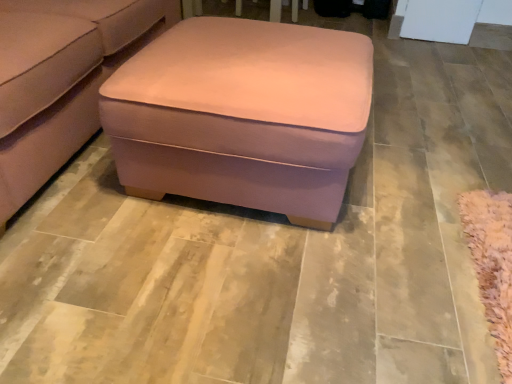
Question: From the image's perspective, is suede-like pink ottoman at center over pink fabric ottoman at center?

Choices:
 (A) yes
 (B) no

Answer: (A)

Question: Is the surface of suede-like pink ottoman at center in direct contact with pink fabric ottoman at center?

Choices:
 (A) no
 (B) yes

Answer: (A)

Question: From a real-world perspective, is suede-like pink ottoman at center located higher than pink fabric ottoman at center?

Choices:
 (A) yes
 (B) no

Answer: (A)

Question: Could you tell me if suede-like pink ottoman at center is facing pink fabric ottoman at center?

Choices:
 (A) no
 (B) yes

Answer: (B)

Question: Is suede-like pink ottoman at center at the right side of pink fabric ottoman at center?

Choices:
 (A) no
 (B) yes

Answer: (A)

Question: Considering the relative sizes of suede-like pink ottoman at center and pink fabric ottoman at center in the image provided, is suede-like pink ottoman at center smaller than pink fabric ottoman at center?

Choices:
 (A) no
 (B) yes

Answer: (A)

Question: Can you confirm if pink fabric ottoman at center is smaller than suede-like pink ottoman at center?

Choices:
 (A) no
 (B) yes

Answer: (B)

Question: Is pink fabric ottoman at center positioned in front of suede-like pink ottoman at center?

Choices:
 (A) no
 (B) yes

Answer: (A)

Question: Considering the relative sizes of pink fabric ottoman at center and suede-like pink ottoman at center in the image provided, is pink fabric ottoman at center thinner than suede-like pink ottoman at center?

Choices:
 (A) no
 (B) yes

Answer: (B)

Question: Could you tell me if pink fabric ottoman at center is facing suede-like pink ottoman at center?

Choices:
 (A) yes
 (B) no

Answer: (B)

Question: From the image's perspective, is pink fabric ottoman at center located above suede-like pink ottoman at center?

Choices:
 (A) yes
 (B) no

Answer: (B)

Question: Is suede-like pink ottoman at center at the back of pink fabric ottoman at center?

Choices:
 (A) yes
 (B) no

Answer: (A)

Question: Considering the positions of point (49, 142) and point (285, 69), is point (49, 142) closer or farther from the camera than point (285, 69)?

Choices:
 (A) closer
 (B) farther

Answer: (B)